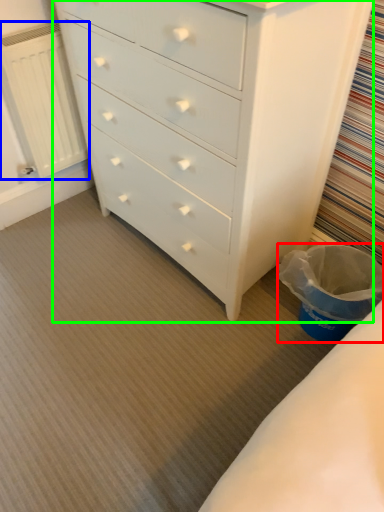
Question: Estimate the real-world distances between objects in this image. Which object is farther from laundry basket (highlighted by a red box), radiator (highlighted by a blue box) or chest of drawers (highlighted by a green box)?

Choices:
 (A) radiator
 (B) chest of drawers

Answer: (A)